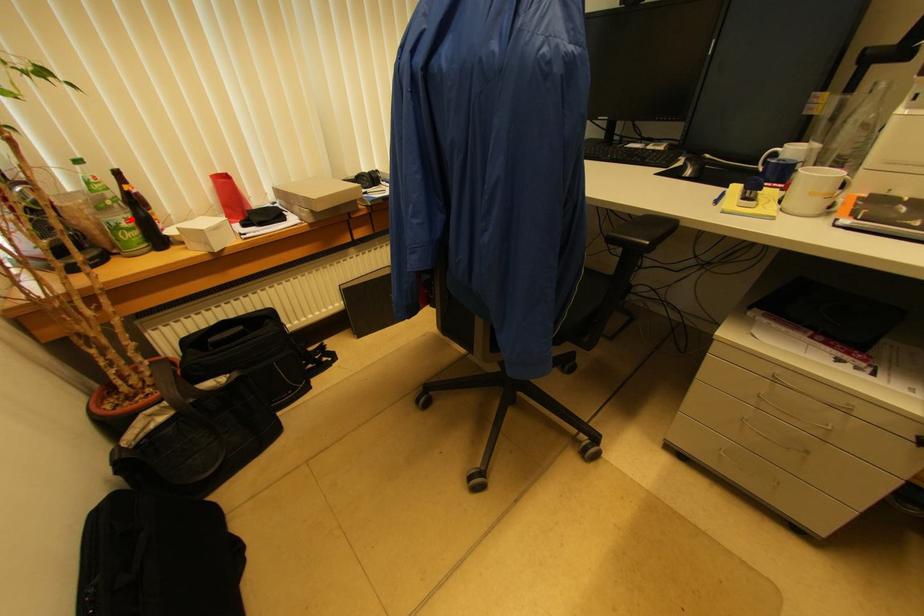
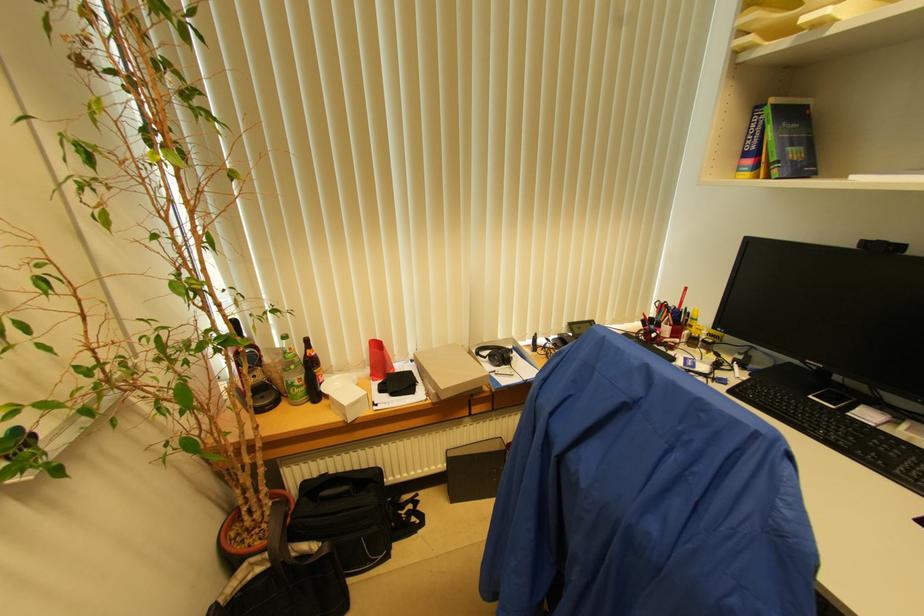
Question: I am providing you with two images of the same scene from different viewpoints. A red point is shown in image1. For the corresponding object point in image2, is it positioned nearer or farther from the camera?

Choices:
 (A) Nearer
 (B) Farther

Answer: (A)